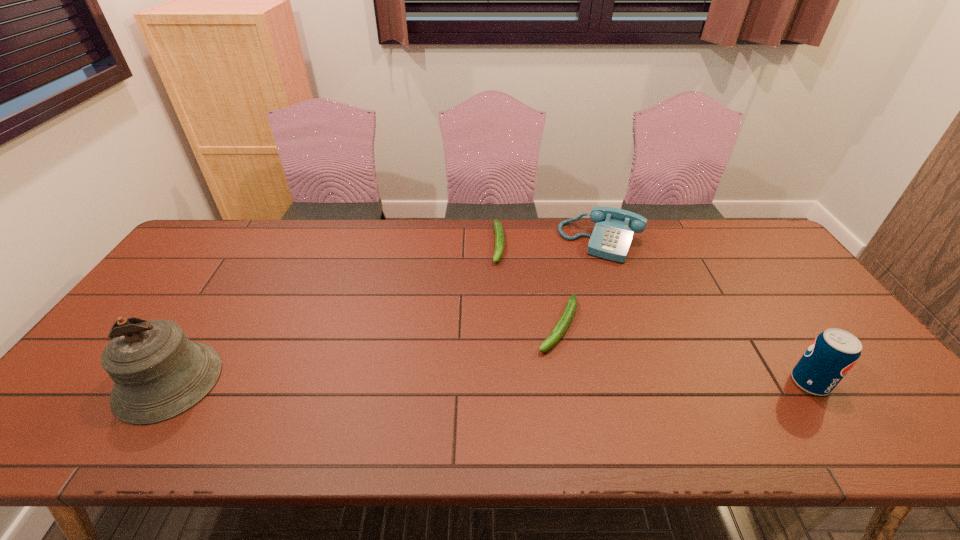
Find the location of a particular element. blank space located on the front-facing side of the left zucchini is located at coordinates (498, 319).

You are a GUI agent. You are given a task and a screenshot of the screen. Output one action in this format:
    pyautogui.click(x=<x>, y=<y>)
    Task: Click on the vacant space located on the front-facing side of the left zucchini
    The image size is (960, 540).
    Given the screenshot: What is the action you would take?
    pyautogui.click(x=498, y=369)

This screenshot has height=540, width=960. Find the location of `vacant position located 0.190m on the front-facing side of the left zucchini`. vacant position located 0.190m on the front-facing side of the left zucchini is located at coordinates (499, 309).

The image size is (960, 540). I want to click on free spot located 0.050m on the front-facing side of the nearer zucchini, so click(x=542, y=365).

What are the coordinates of `vacant space located on the front-facing side of the nearer zucchini` in the screenshot? It's located at (523, 398).

This screenshot has height=540, width=960. In order to click on free spot located 0.180m on the front-facing side of the nearer zucchini in this screenshot , I will do `click(519, 404)`.

Locate an element on the screen. vacant point located on the dial of the third tallest object is located at coordinates (552, 346).

The image size is (960, 540). What are the coordinates of `vacant space positioned 0.120m on the dial of the third tallest object` in the screenshot? It's located at (579, 285).

Image resolution: width=960 pixels, height=540 pixels. Identify the location of free space located 0.300m on the dial of the third tallest object. (562, 325).

Locate an element on the screen. The height and width of the screenshot is (540, 960). zucchini that is at the far edge is located at coordinates (498, 228).